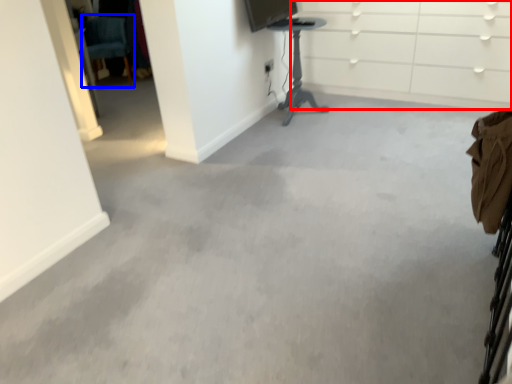
Question: Which of the following is the closest to the observer, dresser (highlighted by a red box) or swivel chair (highlighted by a blue box)?

Choices:
 (A) dresser
 (B) swivel chair

Answer: (A)